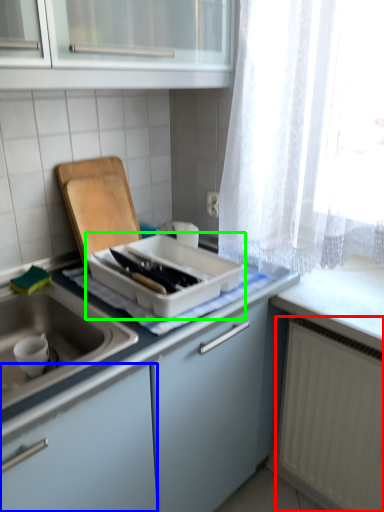
Question: Based on their relative distances, which object is nearer to radiator (highlighted by a red box)? Choose from cabinetry (highlighted by a blue box) and kitchen appliance (highlighted by a green box).

Choices:
 (A) cabinetry
 (B) kitchen appliance

Answer: (B)